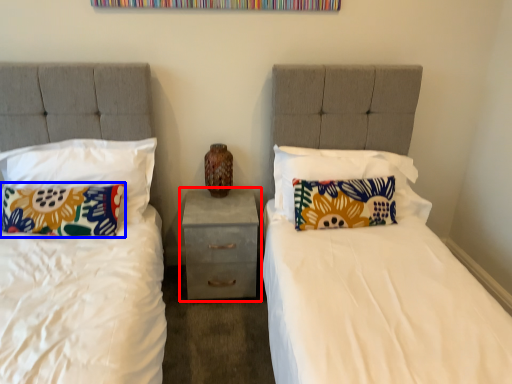
Question: Which point is further to the camera, nightstand (highlighted by a red box) or pillow (highlighted by a blue box)?

Choices:
 (A) nightstand
 (B) pillow

Answer: (A)